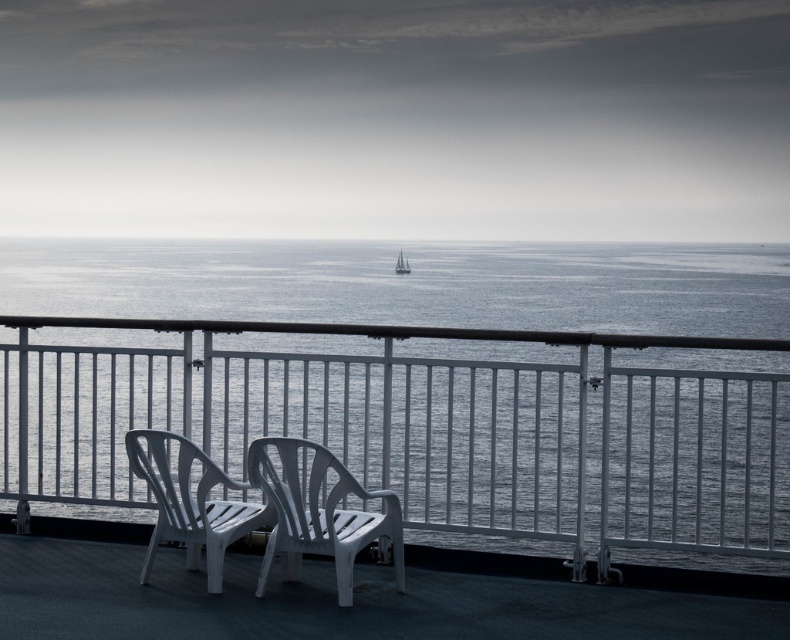
You are standing on a deck overlooking the ocean and see the white plastic chairs at center and the white sailboat at center. Which object is nearer to you?

The white plastic chairs at center are closer to the viewer than the white sailboat at center.

You are standing on the deck and want to place a 2 meter long bench between the gray water at center and the white plastic chair at center. Is there enough space?

The distance between the gray water at center and the white plastic chair at center is 5.39 meters. Since the bench is 2 meters long, there is sufficient space to place it between them.